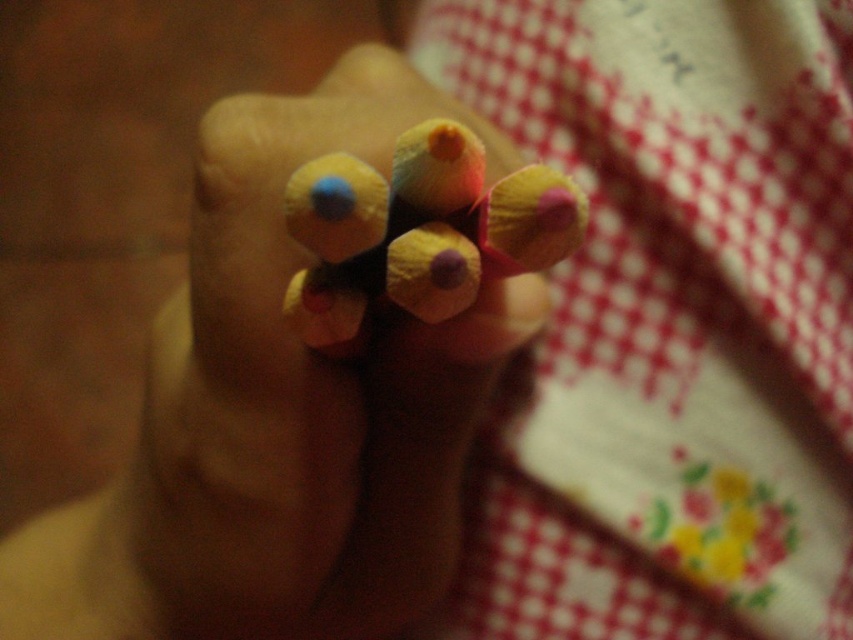
Question: Can you confirm if white dotted fabric at upper center is smaller than matte wooden pencils at center?

Choices:
 (A) no
 (B) yes

Answer: (A)

Question: From the image, what is the correct spatial relationship of wooden pencil case at center in relation to matte wooden pencils at center?

Choices:
 (A) below
 (B) above

Answer: (A)

Question: Which point is farther to the camera?

Choices:
 (A) wooden pencil case at center
 (B) white dotted fabric at upper center

Answer: (B)

Question: Among these points, which one is farthest from the camera?

Choices:
 (A) 511,285
 (B) 824,516

Answer: (B)

Question: Which object appears closest to the camera in this image?

Choices:
 (A) wooden pencil case at center
 (B) matte wooden pencils at center

Answer: (B)

Question: Is white dotted fabric at upper center positioned at the back of matte wooden pencils at center?

Choices:
 (A) no
 (B) yes

Answer: (B)